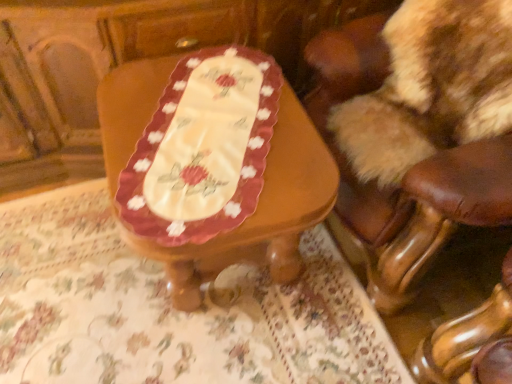
Question: Is brown leather chair at upper right located within beige fabric tablecloth at center?

Choices:
 (A) no
 (B) yes

Answer: (A)

Question: Is the depth of beige fabric tablecloth at center greater than that of brown leather chair at upper right?

Choices:
 (A) no
 (B) yes

Answer: (B)

Question: From a real-world perspective, is beige fabric tablecloth at center located beneath brown leather chair at upper right?

Choices:
 (A) yes
 (B) no

Answer: (A)

Question: Does beige fabric tablecloth at center appear on the right side of brown leather chair at upper right?

Choices:
 (A) yes
 (B) no

Answer: (B)

Question: Considering the relative sizes of beige fabric tablecloth at center and brown leather chair at upper right in the image provided, is beige fabric tablecloth at center wider than brown leather chair at upper right?

Choices:
 (A) yes
 (B) no

Answer: (A)

Question: Is beige fabric tablecloth at center not near brown leather chair at upper right?

Choices:
 (A) yes
 (B) no

Answer: (B)

Question: Can you confirm if wooden table at center is taller than brown leather chair at upper right?

Choices:
 (A) no
 (B) yes

Answer: (A)

Question: Considering the relative positions of wooden table at center and brown leather chair at upper right in the image provided, is wooden table at center to the right of brown leather chair at upper right from the viewer's perspective?

Choices:
 (A) no
 (B) yes

Answer: (A)

Question: From a real-world perspective, is wooden table at center located higher than brown leather chair at upper right?

Choices:
 (A) yes
 (B) no

Answer: (B)

Question: Does wooden table at center have a lesser width compared to brown leather chair at upper right?

Choices:
 (A) yes
 (B) no

Answer: (A)

Question: Considering the relative positions of wooden table at center and brown leather chair at upper right in the image provided, is wooden table at center in front of brown leather chair at upper right?

Choices:
 (A) no
 (B) yes

Answer: (A)

Question: Is wooden table at center turned away from brown leather chair at upper right?

Choices:
 (A) no
 (B) yes

Answer: (B)

Question: Is beige fabric tablecloth at center surrounded by wooden table at center?

Choices:
 (A) yes
 (B) no

Answer: (B)